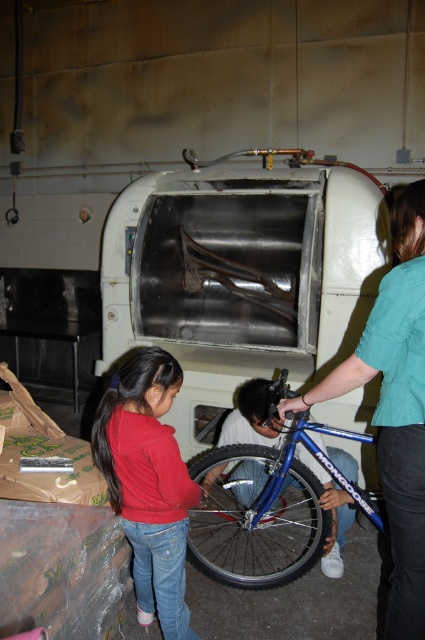
You are a delivery person who needs to place a small package next to the red matte jacket at lower left without blocking the blue metallic tire at lower center. Given their size relationship, where should you place the package?

The red matte jacket at lower left is smaller than the blue metallic tire at lower center. To place the small package next to the jacket without blocking the tire, position it near the jacket but ensure it doesn not extend beyond the jacket toward the tire, as the jacket is smaller and closer to the tire.

You are standing in the workshop and need to determine which of the two points, point (405, 625) or point (224, 540), is closer to you. Based on the scene, which point is nearer?

Point (405, 625) is closer to the viewer than point (224, 540).

You are standing in the workshop and need to reach the blue metallic tire at lower center to fix it. There is a teal fabric shirt at right nearby. Which object is closer to you?

The teal fabric shirt at right is closer to the viewer than the blue metallic tire at lower center, so you should first check the teal fabric shirt at right to see if it is in your way before reaching for the blue metallic tire at lower center.